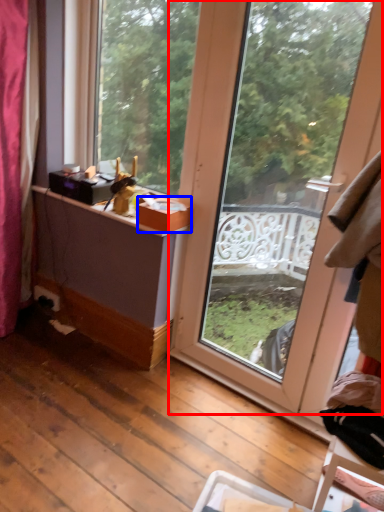
Question: Among these objects, which one is nearest to the camera, window (highlighted by a red box) or box (highlighted by a blue box)?

Choices:
 (A) window
 (B) box

Answer: (A)